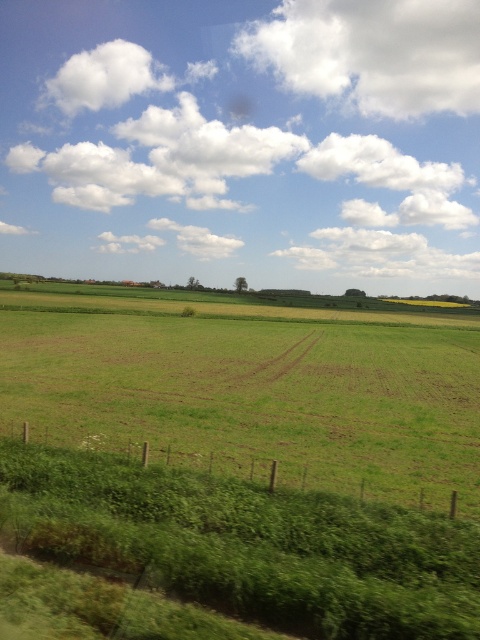
You are standing in the middle of the green grassy field at center and want to walk towards the green leafy grass at lower left. Which direction should you face to walk straight towards it?

Since the green grassy field at center is to the left of green leafy grass at lower left, you should face to the right to walk straight towards the green leafy grass at lower left.

You are a landscape photographer planning to capture the entire green grassy field at center and green leafy grass at lower left in a single frame. Based on their sizes, which area would require more careful framing to ensure it doesn not get cut off?

The green leafy grass at lower left requires more careful framing since it is narrower than the green grassy field at center, which is wider and might occupy more of the frame naturally.